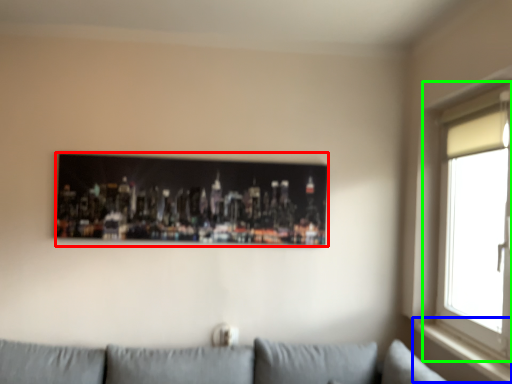
Question: Estimate the real-world distances between objects in this image. Which object is farther from picture frame (highlighted by a red box), window sill (highlighted by a blue box) or window (highlighted by a green box)?

Choices:
 (A) window sill
 (B) window

Answer: (A)